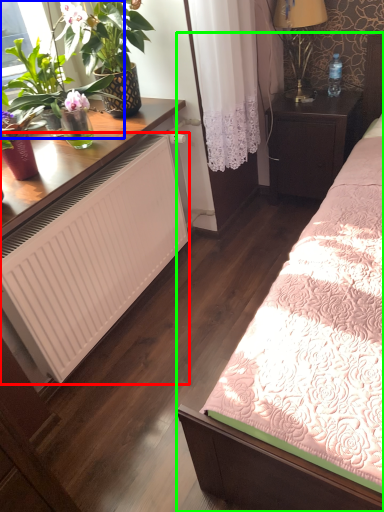
Question: Which object is the closest to the radiator (highlighted by a red box)? Choose among these: houseplant (highlighted by a blue box) or bed (highlighted by a green box).

Choices:
 (A) houseplant
 (B) bed

Answer: (A)